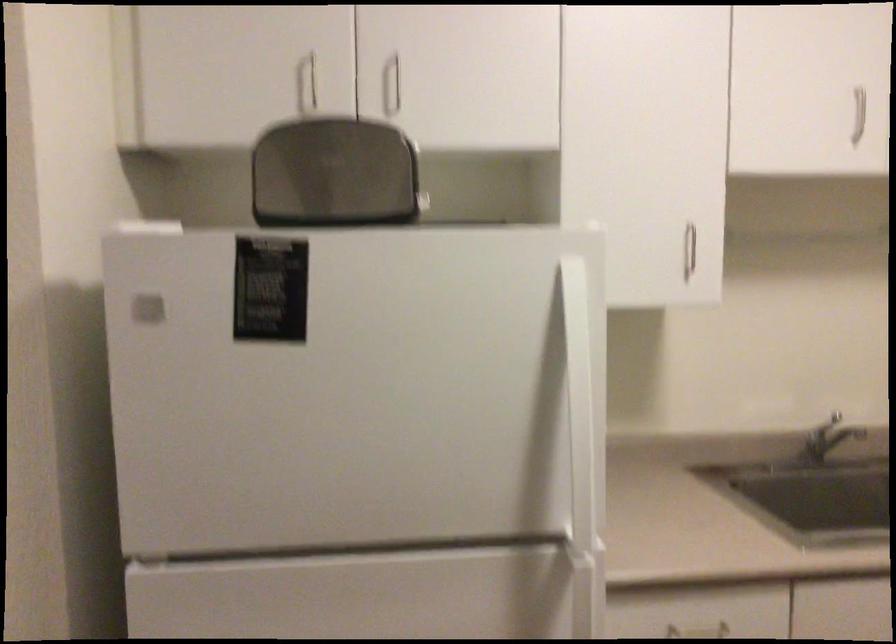
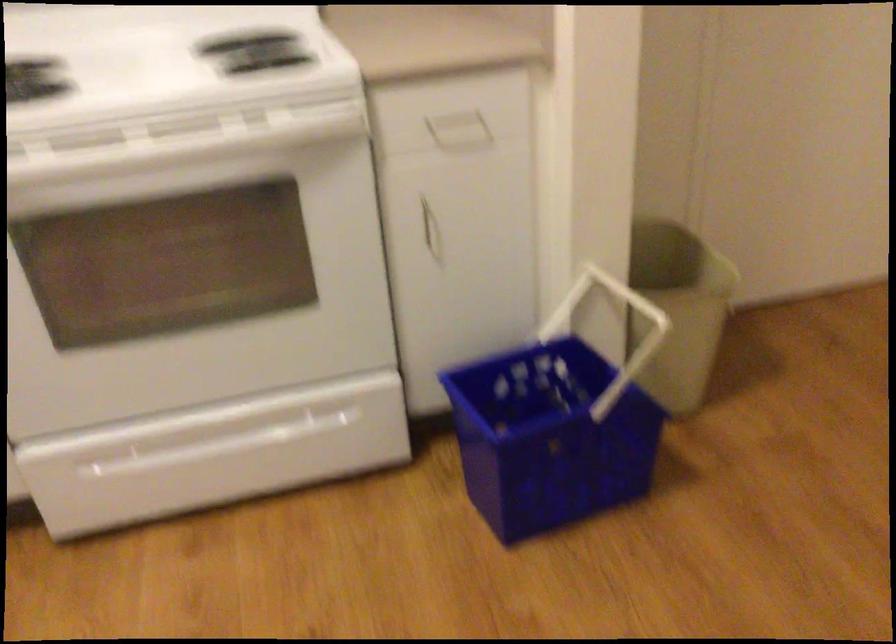
The images are taken continuously from a first-person perspective. In which direction is your viewpoint rotating?

The rotation direction of the camera is right-down.